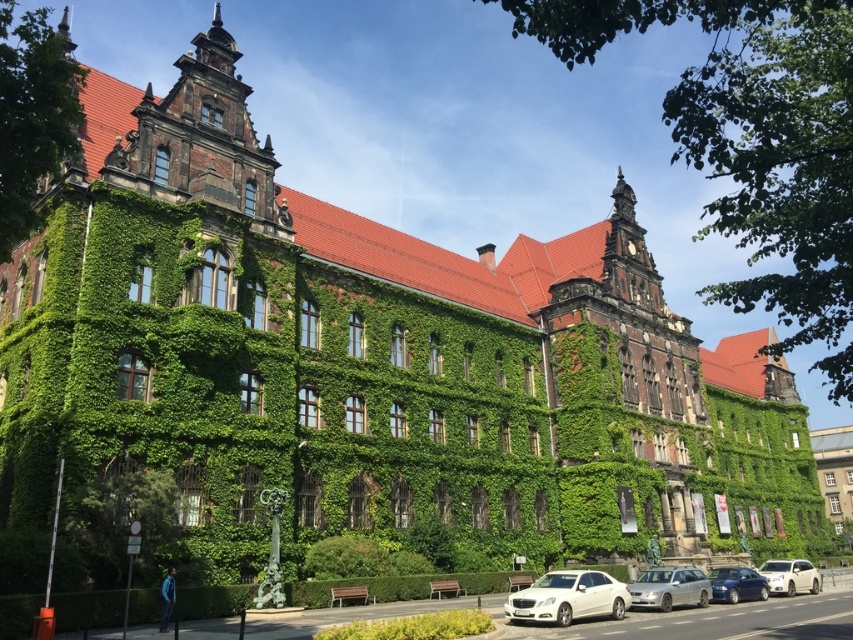
Can you confirm if white glossy sedan at center is smaller than metallic blue sedan at lower right?

Incorrect, white glossy sedan at center is not smaller in size than metallic blue sedan at lower right.

Which of these two, white glossy sedan at center or metallic blue sedan at lower right, stands taller?

With more height is white glossy sedan at center.

The width and height of the screenshot is (853, 640). In order to click on white glossy sedan at center in this screenshot , I will do `click(567, 596)`.

What do you see at coordinates (567, 596) in the screenshot? The image size is (853, 640). I see `white glossy sedan at center` at bounding box center [567, 596].

Can you confirm if white glossy sedan at center is positioned to the left of silver metallic car at lower center?

Correct, you'll find white glossy sedan at center to the left of silver metallic car at lower center.

What do you see at coordinates (567, 596) in the screenshot?
I see `white glossy sedan at center` at bounding box center [567, 596].

You are a GUI agent. You are given a task and a screenshot of the screen. Output one action in this format:
    pyautogui.click(x=<x>, y=<y>)
    Task: Click on the white glossy sedan at center
    This screenshot has width=853, height=640.
    Given the screenshot: What is the action you would take?
    pyautogui.click(x=567, y=596)

Is white glossy sedan at center above white matte car at lower right?

Indeed, white glossy sedan at center is positioned over white matte car at lower right.

Which of these two, white glossy sedan at center or white matte car at lower right, stands taller?

white glossy sedan at center

This screenshot has height=640, width=853. What do you see at coordinates (567, 596) in the screenshot?
I see `white glossy sedan at center` at bounding box center [567, 596].

Where is `white glossy sedan at center`? This screenshot has width=853, height=640. white glossy sedan at center is located at coordinates (567, 596).